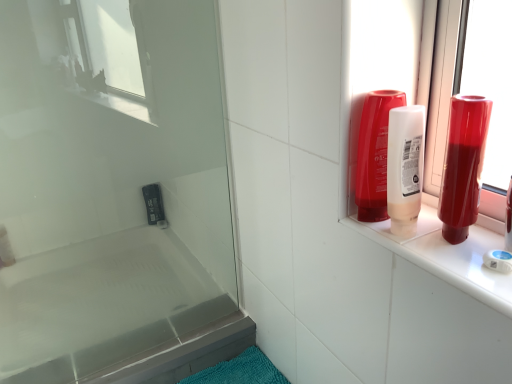
Question: Does translucent plastic soap at lower left appear on the left side of translucent plastic mouthwash at upper right, the 1th mouthwash when ordered from left to right?

Choices:
 (A) no
 (B) yes

Answer: (B)

Question: Considering the relative positions of translucent plastic soap at lower left and translucent plastic mouthwash at upper right, the 1th mouthwash when ordered from left to right, in the image provided, is translucent plastic soap at lower left to the right of translucent plastic mouthwash at upper right, the 1th mouthwash when ordered from left to right, from the viewer's perspective?

Choices:
 (A) yes
 (B) no

Answer: (B)

Question: From a real-world perspective, is translucent plastic soap at lower left below translucent plastic mouthwash at upper right, the 1th mouthwash when ordered from left to right?

Choices:
 (A) no
 (B) yes

Answer: (B)

Question: Is the depth of translucent plastic soap at lower left less than that of translucent plastic mouthwash at upper right, the 1th mouthwash when ordered from left to right?

Choices:
 (A) no
 (B) yes

Answer: (A)

Question: Is translucent plastic soap at lower left taller than translucent plastic mouthwash at upper right, which appears as the second mouthwash when viewed from the right?

Choices:
 (A) no
 (B) yes

Answer: (A)

Question: From the image's perspective, does translucent plastic soap at lower left appear lower than translucent plastic mouthwash at upper right, which appears as the second mouthwash when viewed from the right?

Choices:
 (A) yes
 (B) no

Answer: (A)

Question: Is transparent glass screen door at upper left not close to translucent plastic mouthwash at upper right, which appears as the second mouthwash when viewed from the right?

Choices:
 (A) yes
 (B) no

Answer: (B)

Question: From the image's perspective, is transparent glass screen door at upper left over translucent plastic mouthwash at upper right, the 1th mouthwash when ordered from left to right?

Choices:
 (A) no
 (B) yes

Answer: (A)

Question: Considering the relative sizes of transparent glass screen door at upper left and translucent plastic mouthwash at upper right, the 1th mouthwash when ordered from left to right, in the image provided, is transparent glass screen door at upper left smaller than translucent plastic mouthwash at upper right, the 1th mouthwash when ordered from left to right,?

Choices:
 (A) no
 (B) yes

Answer: (A)

Question: Is transparent glass screen door at upper left placed right next to translucent plastic mouthwash at upper right, the 1th mouthwash when ordered from left to right?

Choices:
 (A) no
 (B) yes

Answer: (A)

Question: Considering the relative positions of transparent glass screen door at upper left and translucent plastic mouthwash at upper right, which appears as the second mouthwash when viewed from the right, in the image provided, is transparent glass screen door at upper left to the right of translucent plastic mouthwash at upper right, which appears as the second mouthwash when viewed from the right, from the viewer's perspective?

Choices:
 (A) no
 (B) yes

Answer: (A)

Question: From a real-world perspective, is transparent glass screen door at upper left physically below translucent plastic mouthwash at upper right, which appears as the second mouthwash when viewed from the right?

Choices:
 (A) no
 (B) yes

Answer: (B)

Question: From a real-world perspective, is shiny red bottle at right, which ranks as the second mouthwash in left-to-right order, physically above transparent glass screen door at upper left?

Choices:
 (A) yes
 (B) no

Answer: (A)